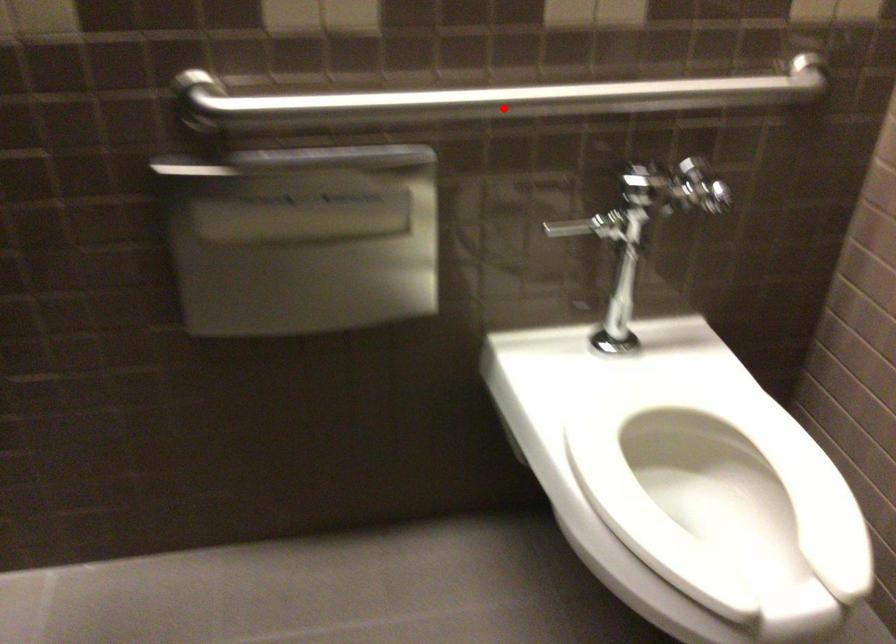
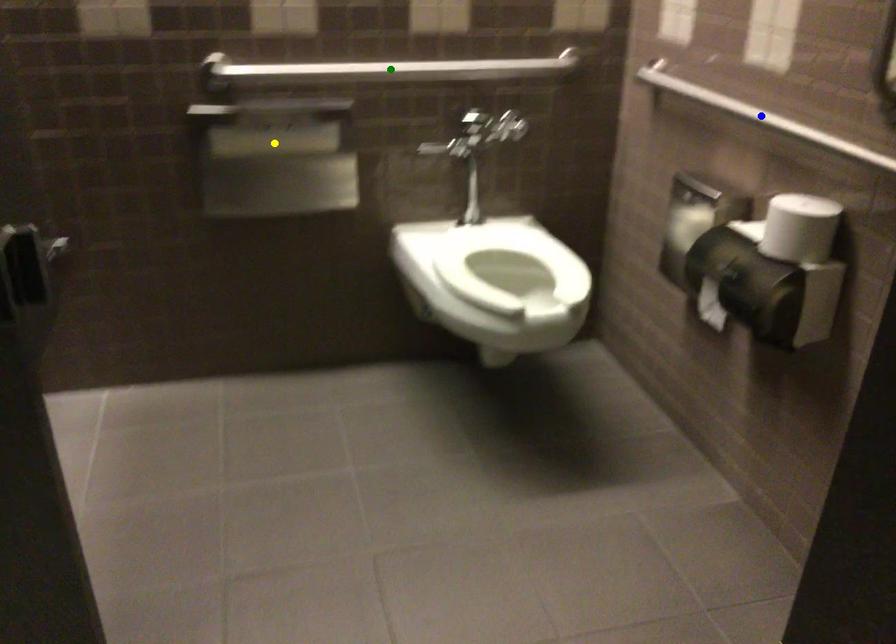
Question: I am providing you with two images of the same scene from different viewpoints. A red point is marked on the first image. You are given multiple points on the second image. Which point in image 2 is actually the same real-world point as the red point in image 1?

Choices:
 (A) yellow point
 (B) green point
 (C) blue point

Answer: (B)